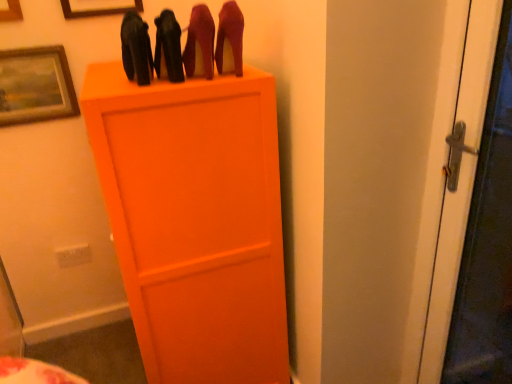
Describe the element at coordinates (136, 49) in the screenshot. The image size is (512, 384). I see `matte black high-heels at upper center, the 3th stuff from the right` at that location.

Find the location of a particular element. This screenshot has height=384, width=512. wooden framed picture at upper left, positioned as the first picture frame in bottom-to-top order is located at coordinates (35, 86).

Image resolution: width=512 pixels, height=384 pixels. Describe the element at coordinates (10, 11) in the screenshot. I see `wooden picture frame at upper left, the 2th picture frame in the bottom-to-top sequence` at that location.

The width and height of the screenshot is (512, 384). Describe the element at coordinates (95, 8) in the screenshot. I see `wooden picture frame at upper left, the third picture frame ordered from the bottom` at that location.

At what (x,y) coordinates should I click in order to perform the action: click on shiny leather high-heels at upper center, the third stuff in the left-to-right sequence. Please return your answer as a coordinate pair (x, y). Image resolution: width=512 pixels, height=384 pixels. Looking at the image, I should click on (200, 44).

This screenshot has height=384, width=512. Identify the location of matte black high-heels at upper center, which appears as the first stuff when viewed from the left. (136, 49).

In order to click on stuff below the matte black high-heels at upper center, which appears as the first stuff when viewed from the left (from a real-world perspective) in this screenshot , I will do `click(168, 48)`.

Does matte black shoes at upper center, which is counted as the second stuff, starting from the left, have a greater width compared to matte black high-heels at upper center, which appears as the first stuff when viewed from the left?

Correct, the width of matte black shoes at upper center, which is counted as the second stuff, starting from the left, exceeds that of matte black high-heels at upper center, which appears as the first stuff when viewed from the left.

Would you say matte black high-heels at upper center, the 3th stuff from the right, is part of matte black shoes at upper center, which is counted as the second stuff, starting from the left,'s contents?

Actually, matte black high-heels at upper center, the 3th stuff from the right, is outside matte black shoes at upper center, which is counted as the second stuff, starting from the left.

Considering the positions of point (178, 33) and point (131, 67), is point (178, 33) closer or farther from the camera than point (131, 67)?

Point (178, 33) is closer to the camera than point (131, 67).

Is shiny leather high-heels at upper center, the first stuff from the right, further to the viewer compared to wooden framed picture at upper left, the 3th picture frame in the top-to-bottom sequence?

No.

Which object is positioned more to the right, shiny leather high-heels at upper center, the first stuff from the right, or wooden framed picture at upper left, the 3th picture frame in the top-to-bottom sequence?

From the viewer's perspective, shiny leather high-heels at upper center, the first stuff from the right, appears more on the right side.

Considering the sizes of objects shiny leather high-heels at upper center, the first stuff from the right, and wooden framed picture at upper left, positioned as the first picture frame in bottom-to-top order, in the image provided, who is bigger, shiny leather high-heels at upper center, the first stuff from the right, or wooden framed picture at upper left, positioned as the first picture frame in bottom-to-top order,?

Bigger between the two is wooden framed picture at upper left, positioned as the first picture frame in bottom-to-top order.

From the image's perspective, does shiny leather high-heels at upper center, the third stuff in the left-to-right sequence, appear lower than wooden framed picture at upper left, the 3th picture frame in the top-to-bottom sequence?

No, from the image's perspective, shiny leather high-heels at upper center, the third stuff in the left-to-right sequence, is not below wooden framed picture at upper left, the 3th picture frame in the top-to-bottom sequence.

Consider the image. Is wooden picture frame at upper left, placed as the first picture frame when sorted from top to bottom, positioned behind matte black shoes at upper center, the second stuff when ordered from right to left?

Yes, it is behind matte black shoes at upper center, the second stuff when ordered from right to left.

In the image, is wooden picture frame at upper left, the third picture frame ordered from the bottom, on the left side or the right side of matte black shoes at upper center, which is counted as the second stuff, starting from the left?

From the image, it's evident that wooden picture frame at upper left, the third picture frame ordered from the bottom, is to the left of matte black shoes at upper center, which is counted as the second stuff, starting from the left.

Between point (89, 16) and point (160, 60), which one is positioned in front?

The point (160, 60) is closer to the camera.

Considering the sizes of objects wooden picture frame at upper left, the third picture frame ordered from the bottom, and matte black shoes at upper center, the second stuff when ordered from right to left, in the image provided, who is smaller, wooden picture frame at upper left, the third picture frame ordered from the bottom, or matte black shoes at upper center, the second stuff when ordered from right to left,?

With smaller size is wooden picture frame at upper left, the third picture frame ordered from the bottom.

From the image's perspective, is wooden picture frame at upper left, the 2th picture frame in the bottom-to-top sequence, on wooden framed picture at upper left, positioned as the first picture frame in bottom-to-top order?

Yes.

In the scene shown: From a real-world perspective, does wooden picture frame at upper left, the 2th picture frame in the bottom-to-top sequence, stand above wooden framed picture at upper left, the 3th picture frame in the top-to-bottom sequence?

Indeed, from a real-world perspective, wooden picture frame at upper left, the 2th picture frame in the bottom-to-top sequence, stands above wooden framed picture at upper left, the 3th picture frame in the top-to-bottom sequence.

Considering the sizes of objects wooden picture frame at upper left, which appears as the second picture frame when viewed from the top, and wooden framed picture at upper left, the 3th picture frame in the top-to-bottom sequence, in the image provided, who is shorter, wooden picture frame at upper left, which appears as the second picture frame when viewed from the top, or wooden framed picture at upper left, the 3th picture frame in the top-to-bottom sequence,?

With less height is wooden framed picture at upper left, the 3th picture frame in the top-to-bottom sequence.

Between wooden framed picture at upper left, positioned as the first picture frame in bottom-to-top order, and wooden picture frame at upper left, which appears as the second picture frame when viewed from the top, which one has more height?

wooden picture frame at upper left, which appears as the second picture frame when viewed from the top, is taller.

Which is more to the left, wooden framed picture at upper left, positioned as the first picture frame in bottom-to-top order, or wooden picture frame at upper left, the 2th picture frame in the bottom-to-top sequence?

From the viewer's perspective, wooden picture frame at upper left, the 2th picture frame in the bottom-to-top sequence, appears more on the left side.

Where is `the 1st picture frame counting from the right of the wooden picture frame at upper left, the 2th picture frame in the bottom-to-top sequence`? The width and height of the screenshot is (512, 384). the 1st picture frame counting from the right of the wooden picture frame at upper left, the 2th picture frame in the bottom-to-top sequence is located at coordinates [35, 86].

Who is smaller, wooden framed picture at upper left, the 3th picture frame in the top-to-bottom sequence, or wooden picture frame at upper left, which appears as the second picture frame when viewed from the top?

With smaller size is wooden picture frame at upper left, which appears as the second picture frame when viewed from the top.

How different are the orientations of wooden picture frame at upper left, placed as the first picture frame when sorted from top to bottom, and matte black high-heels at upper center, the 3th stuff from the right, in degrees?

They differ by 0.184 degrees in their facing directions.

In the scene shown: Considering the positions of objects wooden picture frame at upper left, placed as the first picture frame when sorted from top to bottom, and matte black high-heels at upper center, which appears as the first stuff when viewed from the left, in the image provided, who is behind, wooden picture frame at upper left, placed as the first picture frame when sorted from top to bottom, or matte black high-heels at upper center, which appears as the first stuff when viewed from the left,?

wooden picture frame at upper left, placed as the first picture frame when sorted from top to bottom, is further away from the camera.

From a real-world perspective, does wooden picture frame at upper left, placed as the first picture frame when sorted from top to bottom, stand above matte black high-heels at upper center, which appears as the first stuff when viewed from the left?

Indeed, from a real-world perspective, wooden picture frame at upper left, placed as the first picture frame when sorted from top to bottom, stands above matte black high-heels at upper center, which appears as the first stuff when viewed from the left.

Looking at their sizes, would you say wooden picture frame at upper left, placed as the first picture frame when sorted from top to bottom, is wider or thinner than matte black high-heels at upper center, the 3th stuff from the right?

Clearly, wooden picture frame at upper left, placed as the first picture frame when sorted from top to bottom, has less width compared to matte black high-heels at upper center, the 3th stuff from the right.

From a real-world perspective, is matte black high-heels at upper center, the 3th stuff from the right, on top of wooden framed picture at upper left, positioned as the first picture frame in bottom-to-top order?

Yes, from a real-world perspective, matte black high-heels at upper center, the 3th stuff from the right, is on top of wooden framed picture at upper left, positioned as the first picture frame in bottom-to-top order.

Is wooden framed picture at upper left, positioned as the first picture frame in bottom-to-top order, a part of matte black high-heels at upper center, the 3th stuff from the right?

No, wooden framed picture at upper left, positioned as the first picture frame in bottom-to-top order, is not a part of matte black high-heels at upper center, the 3th stuff from the right.

This screenshot has width=512, height=384. In order to click on picture frame that is the 2nd object to the left of the matte black high-heels at upper center, which appears as the first stuff when viewed from the left, starting at the anchor in this screenshot , I will do `click(35, 86)`.

In the scene shown: Can you confirm if matte black high-heels at upper center, the 3th stuff from the right, is wider than wooden framed picture at upper left, positioned as the first picture frame in bottom-to-top order?

Yes, matte black high-heels at upper center, the 3th stuff from the right, is wider than wooden framed picture at upper left, positioned as the first picture frame in bottom-to-top order.

From the image's perspective, which stuff is the 2nd one below the matte black shoes at upper center, the second stuff when ordered from right to left? Please provide its 2D coordinates.

[(136, 49)]

Where is `the 3rd stuff to the right when counting from the wooden framed picture at upper left, positioned as the first picture frame in bottom-to-top order`? the 3rd stuff to the right when counting from the wooden framed picture at upper left, positioned as the first picture frame in bottom-to-top order is located at coordinates (200, 44).

When comparing their distances from matte black high-heels at upper center, the 3th stuff from the right, does matte black shoes at upper center, the second stuff when ordered from right to left, or wooden picture frame at upper left, the third picture frame ordered from the bottom, seem closer?

matte black shoes at upper center, the second stuff when ordered from right to left, is positioned closer to the anchor matte black high-heels at upper center, the 3th stuff from the right.

Which object lies nearer to the anchor point wooden framed picture at upper left, the 3th picture frame in the top-to-bottom sequence, wooden picture frame at upper left, the 2th picture frame in the bottom-to-top sequence, or shiny leather high-heels at upper center, the first stuff from the right?

wooden picture frame at upper left, the 2th picture frame in the bottom-to-top sequence, is closer to wooden framed picture at upper left, the 3th picture frame in the top-to-bottom sequence.

Based on their spatial positions, is wooden framed picture at upper left, the 3th picture frame in the top-to-bottom sequence, or wooden picture frame at upper left, the 2th picture frame in the bottom-to-top sequence, further from wooden picture frame at upper left, the third picture frame ordered from the bottom?

wooden framed picture at upper left, the 3th picture frame in the top-to-bottom sequence, is positioned further to the anchor wooden picture frame at upper left, the third picture frame ordered from the bottom.

From the image, which object appears to be farther from wooden picture frame at upper left, placed as the first picture frame when sorted from top to bottom, wooden picture frame at upper left, the 2th picture frame in the bottom-to-top sequence, or matte black shoes at upper center, the second stuff when ordered from right to left?

The object further to wooden picture frame at upper left, placed as the first picture frame when sorted from top to bottom, is matte black shoes at upper center, the second stuff when ordered from right to left.

From the image, which object appears to be farther from wooden picture frame at upper left, the 2th picture frame in the bottom-to-top sequence, matte black high-heels at upper center, which appears as the first stuff when viewed from the left, or shiny leather high-heels at upper center, the third stuff in the left-to-right sequence?

shiny leather high-heels at upper center, the third stuff in the left-to-right sequence, is positioned further to the anchor wooden picture frame at upper left, the 2th picture frame in the bottom-to-top sequence.

Which object lies further to the anchor point matte black high-heels at upper center, the 3th stuff from the right, shiny leather high-heels at upper center, the third stuff in the left-to-right sequence, or wooden picture frame at upper left, the 2th picture frame in the bottom-to-top sequence?

wooden picture frame at upper left, the 2th picture frame in the bottom-to-top sequence, is further to matte black high-heels at upper center, the 3th stuff from the right.

Considering their positions, is matte black shoes at upper center, the second stuff when ordered from right to left, positioned closer to wooden framed picture at upper left, the 3th picture frame in the top-to-bottom sequence, than shiny leather high-heels at upper center, the first stuff from the right?

Based on the image, matte black shoes at upper center, the second stuff when ordered from right to left, appears to be nearer to wooden framed picture at upper left, the 3th picture frame in the top-to-bottom sequence.

Estimate the real-world distances between objects in this image. Which object is closer to wooden picture frame at upper left, placed as the first picture frame when sorted from top to bottom, matte black shoes at upper center, the second stuff when ordered from right to left, or matte black high-heels at upper center, the 3th stuff from the right?

matte black high-heels at upper center, the 3th stuff from the right.

Image resolution: width=512 pixels, height=384 pixels. I want to click on stuff positioned between shiny leather high-heels at upper center, the first stuff from the right, and wooden picture frame at upper left, the third picture frame ordered from the bottom, from near to far, so (x=168, y=48).

Locate an element on the screen. The image size is (512, 384). stuff situated between wooden framed picture at upper left, positioned as the first picture frame in bottom-to-top order, and matte black shoes at upper center, the second stuff when ordered from right to left, from left to right is located at coordinates (136, 49).

The image size is (512, 384). Identify the location of stuff between matte black high-heels at upper center, which appears as the first stuff when viewed from the left, and shiny leather high-heels at upper center, the third stuff in the left-to-right sequence, in the horizontal direction. (x=168, y=48).

I want to click on stuff between wooden picture frame at upper left, which appears as the second picture frame when viewed from the top, and matte black shoes at upper center, which is counted as the second stuff, starting from the left, so click(x=136, y=49).